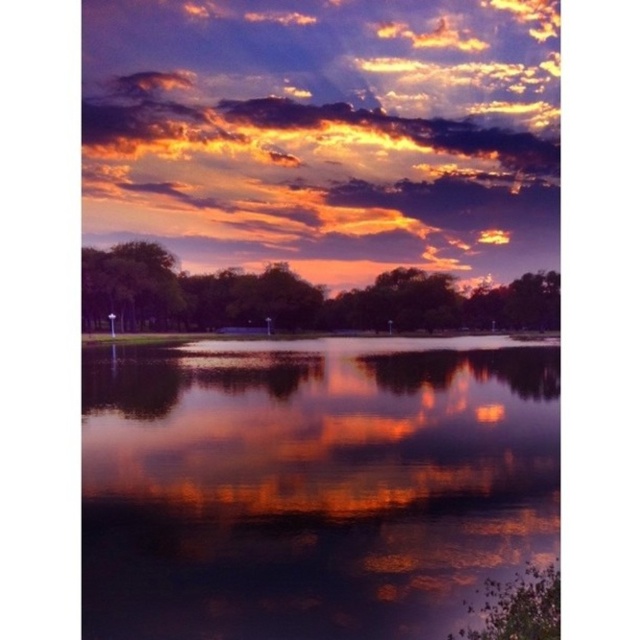
You are standing at the edge of the lake watching the sunset. There are two points marked on the water surface. The first point is at coordinates point (442, 372) and the second is at point (301, 97). Which point is closer to you?

Point (442, 372) is closer to the viewer than point (301, 97).

You are standing at the edge of the water in the sunset scene. There is a point marked at coordinates (310,484). What does this point represent in the scene?

The point at coordinates (310,484) marks the location of glossy reflective water at center in the scene.

You are standing at the edge of the water and want to place a small floating lantern exactly 40 feet away from where you are standing. Can you determine if the glossy reflective water at center is within the required distance for placing the lantern?

The glossy reflective water at center is 43.21 feet from viewer. Since the required distance is 40 feet, the water is slightly beyond the desired placement. You may need to move closer or adjust the placement to ensure it is within the 40 feet range.